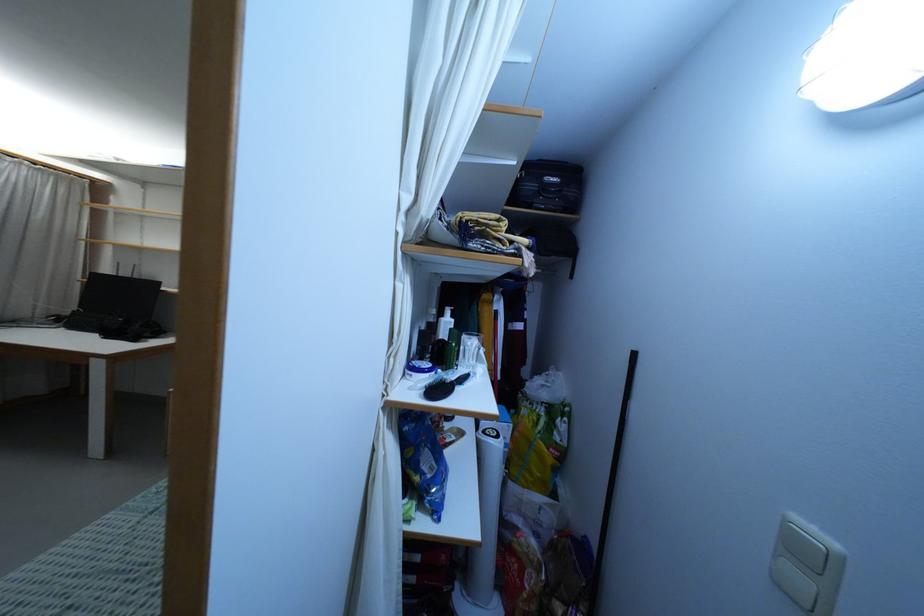
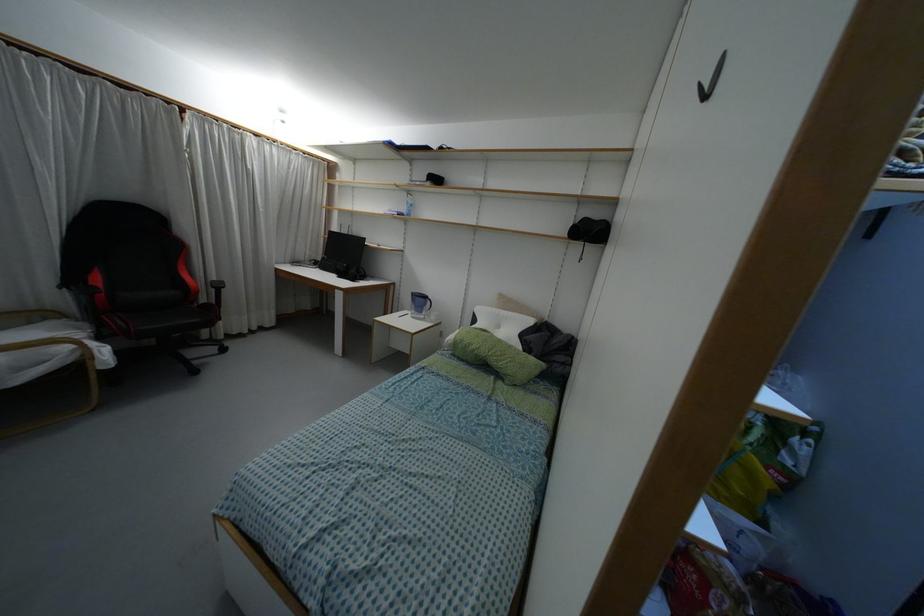
Question: The camera is either moving clockwise (left) or counter-clockwise (right) around the object. The first image is from the beginning of the video and the second image is from the end. Is the camera moving left or right when shooting the video?

Choices:
 (A) Left
 (B) Right

Answer: (B)